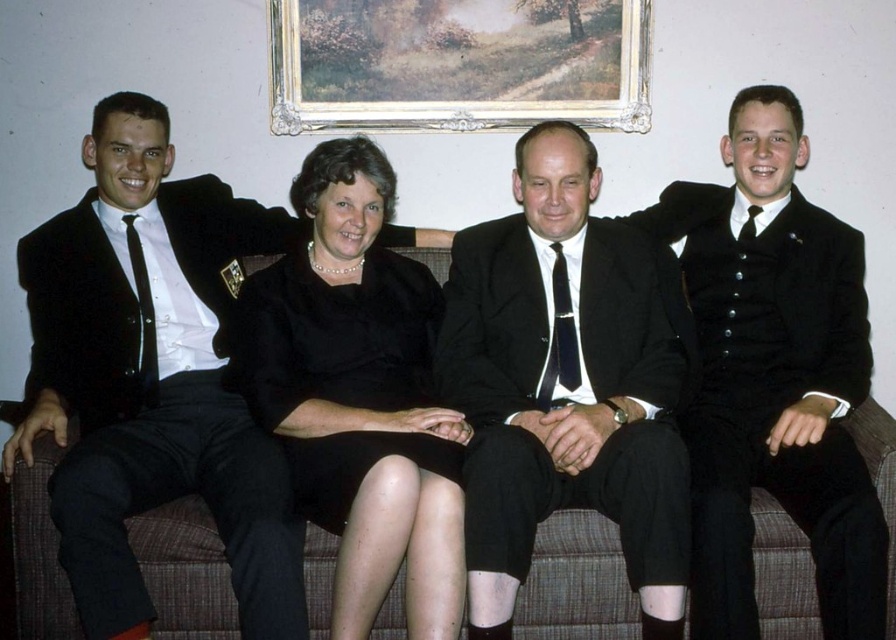
You are a photographer setting up for a group photo. You need to arrange the black satin suit at center and the matte black tie at left in a way that the black satin suit is to the right of the matte black tie. Is the current arrangement correct?

Yes, the current arrangement is correct because the black satin suit at center is positioned on the right side of the matte black tie at left as described in the Objects Description.

You are a tailor who needs to determine which item requires more fabric for alterations. Based on the image, which item has a larger size between the black satin suit at center and the matte black tie at left?

The black satin suit at center has a larger size compared to the matte black tie at left, so it would require more fabric for alterations.